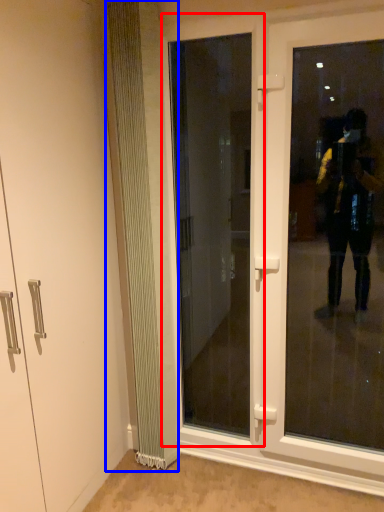
Question: Which object is further to the camera taking this photo, door (highlighted by a red box) or radiator (highlighted by a blue box)?

Choices:
 (A) door
 (B) radiator

Answer: (A)